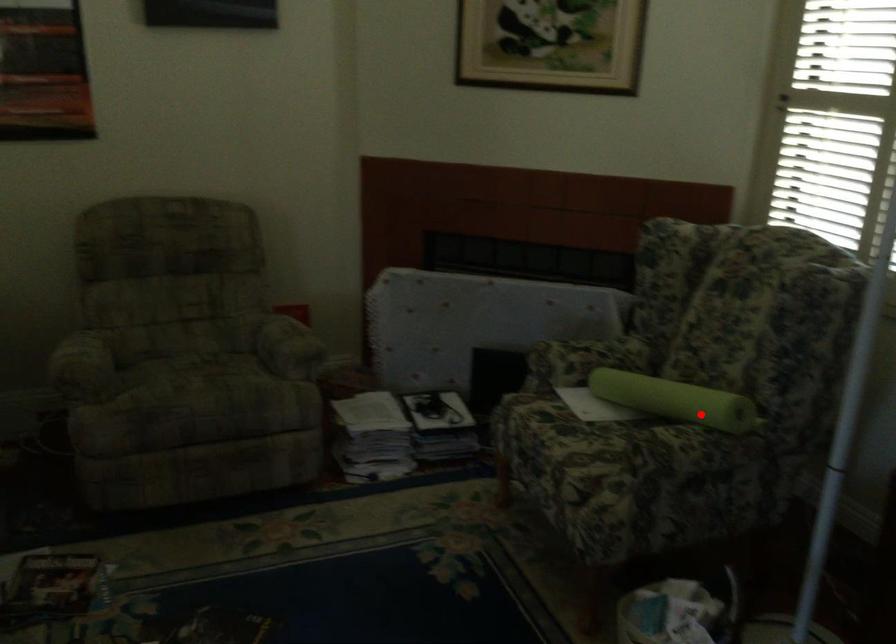
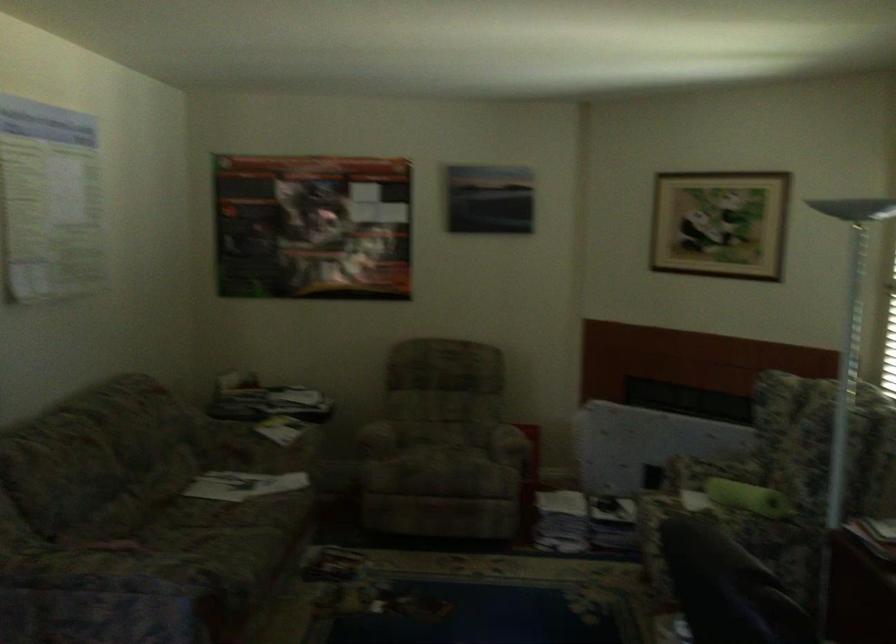
The point at the highlighted location is marked in the first image. Where is the corresponding point in the second image?

(748, 498)